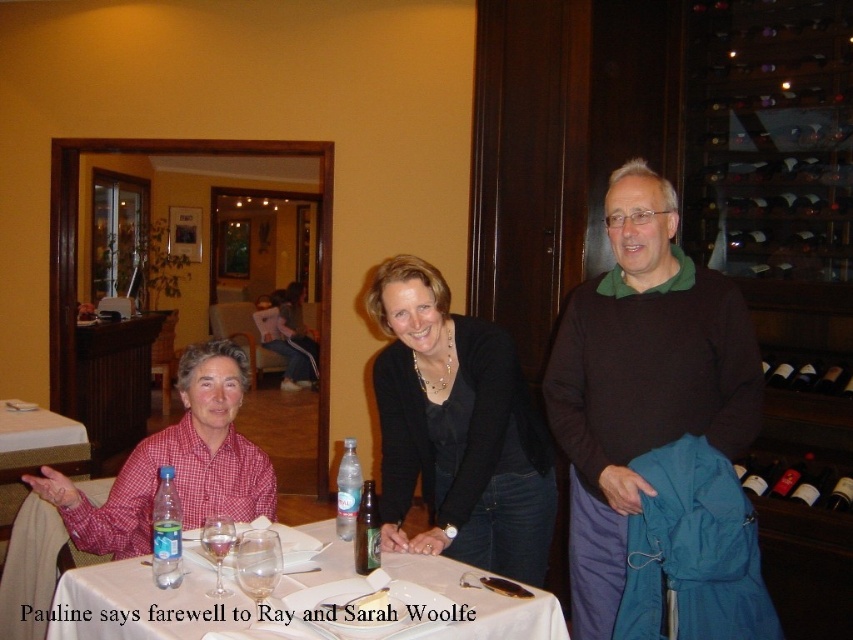
Question: Is dark brown sweater at center above clear plastic bottle at table left?

Choices:
 (A) no
 (B) yes

Answer: (B)

Question: Which point is farther to the camera?

Choices:
 (A) dark wood wine rack at right
 (B) white paper napkin at center

Answer: (A)

Question: Does white paper napkin at center have a smaller size compared to white textured table at lower left?

Choices:
 (A) no
 (B) yes

Answer: (A)

Question: Considering the real-world distances, which object is closest to the clear plastic bottle at table left?

Choices:
 (A) matte black jacket at center
 (B) green glass bottle at table
 (C) dark brown sweater at center

Answer: (B)

Question: Among these points, which one is farthest from the camera?

Choices:
 (A) (367, 572)
 (B) (776, 385)
 (C) (265, 572)
 (D) (357, 500)

Answer: (B)

Question: Can you confirm if white paper napkin at center is positioned to the left of clear glass at table center?

Choices:
 (A) no
 (B) yes

Answer: (A)